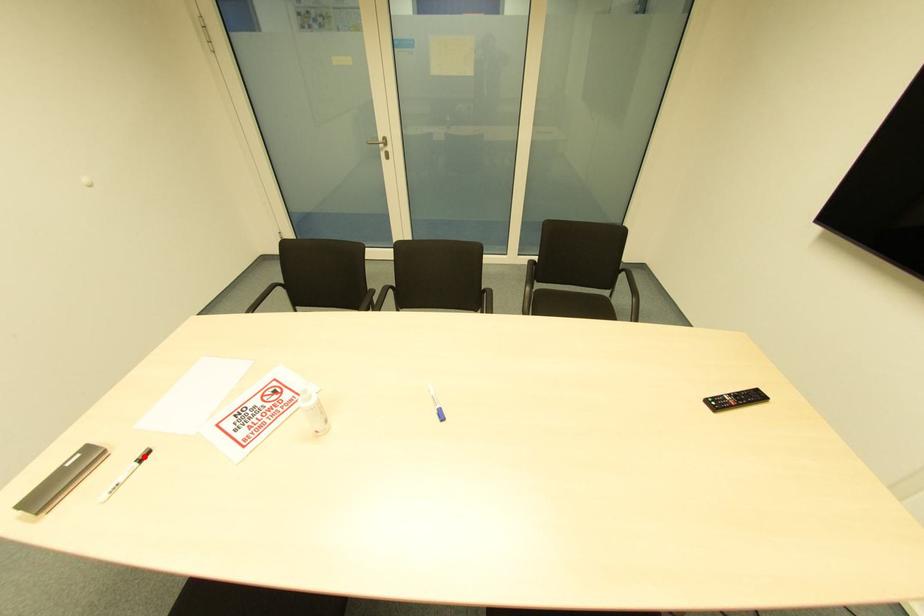
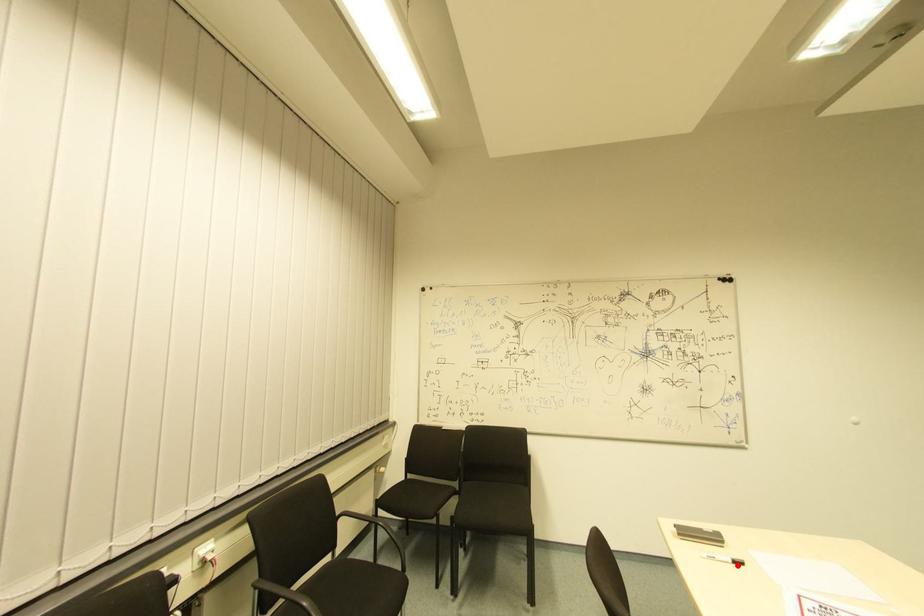
I am providing you with two images of the same scene from different viewpoints. A red point is marked on the first image and another point is marked on the second image. Is the red point in image1 aligned with the point shown in image2?

Yes